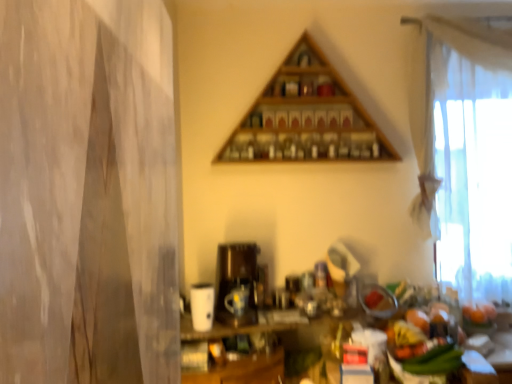
Question: Is white sheer curtain at right at the left side of matte black coffee machine at center?

Choices:
 (A) yes
 (B) no

Answer: (B)

Question: Is white sheer curtain at right not within matte black coffee machine at center?

Choices:
 (A) yes
 (B) no

Answer: (A)

Question: Considering the relative sizes of white sheer curtain at right and matte black coffee machine at center in the image provided, is white sheer curtain at right wider than matte black coffee machine at center?

Choices:
 (A) yes
 (B) no

Answer: (B)

Question: Considering the relative positions of white sheer curtain at right and matte black coffee machine at center in the image provided, is white sheer curtain at right in front of matte black coffee machine at center?

Choices:
 (A) yes
 (B) no

Answer: (B)

Question: Does white sheer curtain at right have a lesser width compared to matte black coffee machine at center?

Choices:
 (A) no
 (B) yes

Answer: (B)

Question: Is matte black coffee machine at center situated inside white sheer curtain at right or outside?

Choices:
 (A) inside
 (B) outside

Answer: (B)

Question: Considering the relative positions of matte black coffee machine at center and white sheer curtain at right in the image provided, is matte black coffee machine at center to the left or to the right of white sheer curtain at right?

Choices:
 (A) right
 (B) left

Answer: (B)

Question: Considering the positions of point (245, 291) and point (456, 276), is point (245, 291) closer or farther from the camera than point (456, 276)?

Choices:
 (A) farther
 (B) closer

Answer: (B)

Question: Looking at the image, does matte black coffee machine at center seem bigger or smaller compared to white sheer curtain at right?

Choices:
 (A) small
 (B) big

Answer: (B)

Question: Is wooden triangle at upper center in front of or behind matte black coffee machine at center in the image?

Choices:
 (A) front
 (B) behind

Answer: (B)

Question: Does point (291, 87) appear closer or farther from the camera than point (234, 243)?

Choices:
 (A) farther
 (B) closer

Answer: (B)

Question: Is wooden triangle at upper center situated inside matte black coffee machine at center or outside?

Choices:
 (A) inside
 (B) outside

Answer: (B)

Question: Considering the positions of wooden triangle at upper center and matte black coffee machine at center in the image, is wooden triangle at upper center wider or thinner than matte black coffee machine at center?

Choices:
 (A) thin
 (B) wide

Answer: (A)

Question: In terms of height, does white sheer curtain at right look taller or shorter compared to matte black coffee machine at center?

Choices:
 (A) tall
 (B) short

Answer: (A)

Question: From a real-world perspective, is white sheer curtain at right positioned above or below matte black coffee machine at center?

Choices:
 (A) above
 (B) below

Answer: (A)